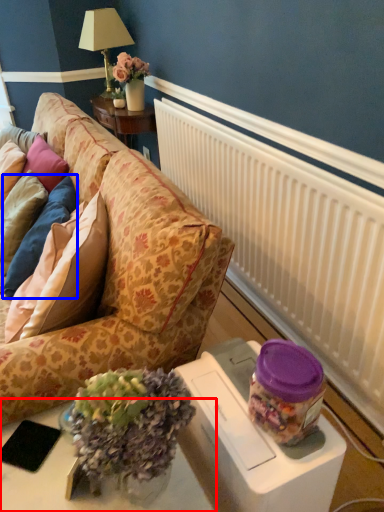
Question: Among these objects, which one is farthest to the camera, table (highlighted by a red box) or pillow (highlighted by a blue box)?

Choices:
 (A) table
 (B) pillow

Answer: (B)